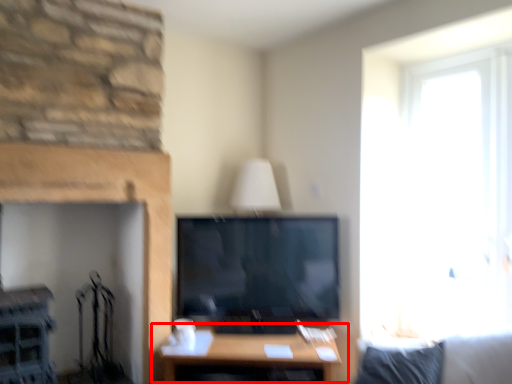
Question: Where is table (annotated by the red box) located in relation to fireplace in the image?

Choices:
 (A) right
 (B) left

Answer: (A)